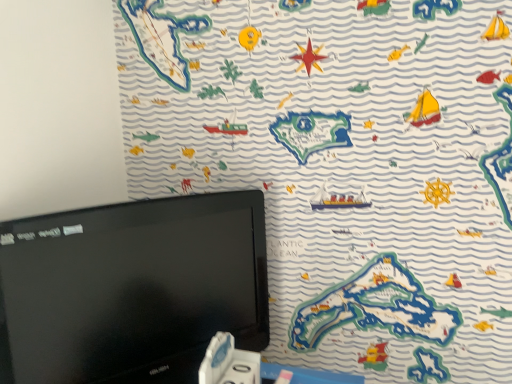
Question: Is white plastic game controller at bottom bigger than black glossy monitor at upper left?

Choices:
 (A) no
 (B) yes

Answer: (A)

Question: From the image's perspective, is white plastic game controller at bottom beneath black glossy monitor at upper left?

Choices:
 (A) yes
 (B) no

Answer: (A)

Question: From the image's perspective, is white plastic game controller at bottom on top of black glossy monitor at upper left?

Choices:
 (A) no
 (B) yes

Answer: (A)

Question: Is white plastic game controller at bottom shorter than black glossy monitor at upper left?

Choices:
 (A) yes
 (B) no

Answer: (A)

Question: Is white plastic game controller at bottom at the left side of black glossy monitor at upper left?

Choices:
 (A) yes
 (B) no

Answer: (B)

Question: Is white plastic game controller at bottom wider than black glossy monitor at upper left?

Choices:
 (A) no
 (B) yes

Answer: (A)

Question: Considering the relative sizes of black glossy monitor at upper left and white plastic game controller at bottom in the image provided, is black glossy monitor at upper left bigger than white plastic game controller at bottom?

Choices:
 (A) no
 (B) yes

Answer: (B)

Question: Is black glossy monitor at upper left positioned with its back to white plastic game controller at bottom?

Choices:
 (A) yes
 (B) no

Answer: (A)

Question: Is black glossy monitor at upper left beside white plastic game controller at bottom?

Choices:
 (A) no
 (B) yes

Answer: (A)

Question: Is there a large distance between black glossy monitor at upper left and white plastic game controller at bottom?

Choices:
 (A) yes
 (B) no

Answer: (B)

Question: Can you confirm if black glossy monitor at upper left is smaller than white plastic game controller at bottom?

Choices:
 (A) yes
 (B) no

Answer: (B)

Question: Can you confirm if black glossy monitor at upper left is wider than white plastic game controller at bottom?

Choices:
 (A) yes
 (B) no

Answer: (A)

Question: Looking at their shapes, would you say black glossy monitor at upper left is wider or thinner than white plastic game controller at bottom?

Choices:
 (A) wide
 (B) thin

Answer: (A)